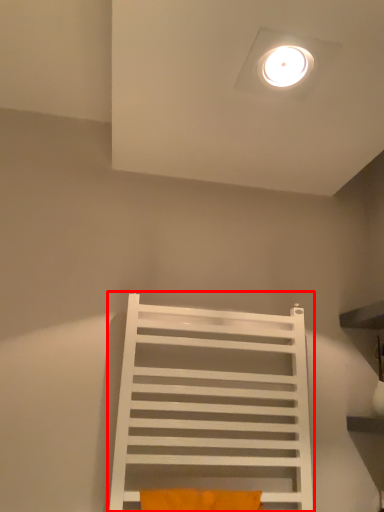
Question: Considering the relative positions of furniture (annotated by the red box) and pillow in the image provided, where is furniture (annotated by the red box) located with respect to the staircase?

Choices:
 (A) right
 (B) left

Answer: (B)